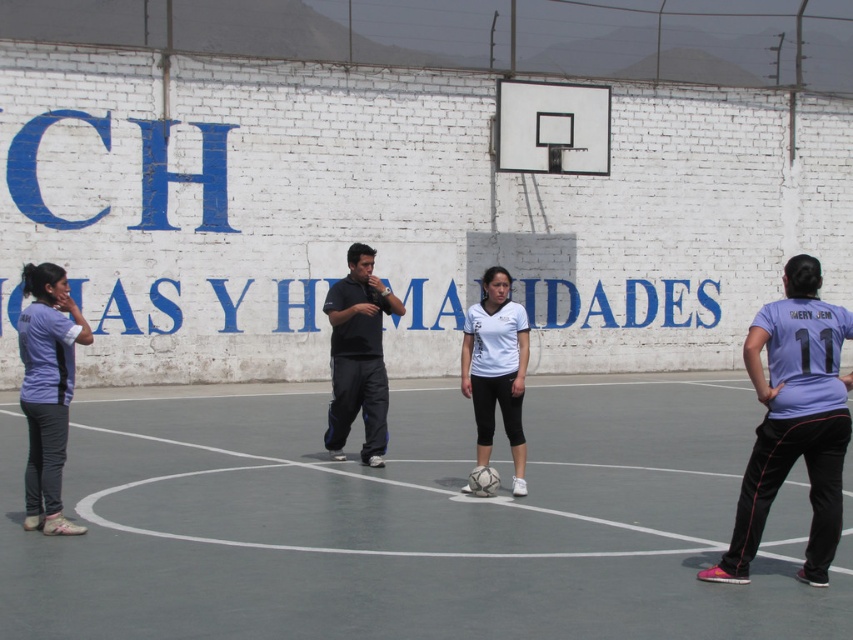
Can you confirm if white rubber court at center is shorter than purple fabric shirt at left?

Yes.

Which is more to the right, white rubber court at center or purple fabric shirt at left?

From the viewer's perspective, white rubber court at center appears more on the right side.

You are a GUI agent. You are given a task and a screenshot of the screen. Output one action in this format:
    pyautogui.click(x=<x>, y=<y>)
    Task: Click on the white rubber court at center
    
    Given the screenshot: What is the action you would take?
    pyautogui.click(x=409, y=522)

Which is in front, point (756, 314) or point (381, 429)?

Positioned in front is point (756, 314).

Which is more to the right, purple matte shirt at right or black matte shirt at center?

purple matte shirt at right is more to the right.

Which is behind, point (811, 392) or point (341, 440)?

The point (341, 440) is behind.

You are a GUI agent. You are given a task and a screenshot of the screen. Output one action in this format:
    pyautogui.click(x=<x>, y=<y>)
    Task: Click on the purple matte shirt at right
    Image resolution: width=853 pixels, height=640 pixels.
    Given the screenshot: What is the action you would take?
    pyautogui.click(x=793, y=420)

Does white rubber court at center have a larger size compared to purple matte shirt at right?

Indeed, white rubber court at center has a larger size compared to purple matte shirt at right.

Can you confirm if white rubber court at center is positioned below purple matte shirt at right?

Indeed, white rubber court at center is positioned under purple matte shirt at right.

Which is in front, point (643, 621) or point (766, 483)?

Positioned in front is point (643, 621).

Find the location of `white rubber court at center`. white rubber court at center is located at coordinates (409, 522).